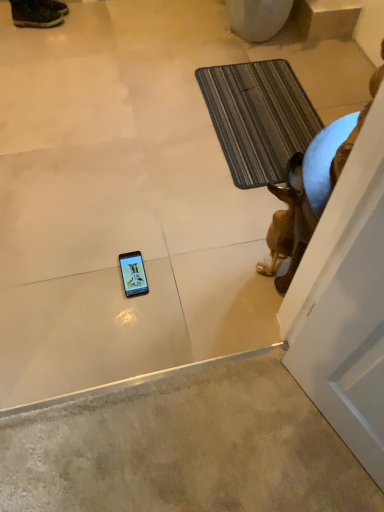
The width and height of the screenshot is (384, 512). In order to click on free point above striped fabric bath mat at upper right (from a real-world perspective) in this screenshot , I will do `click(261, 109)`.